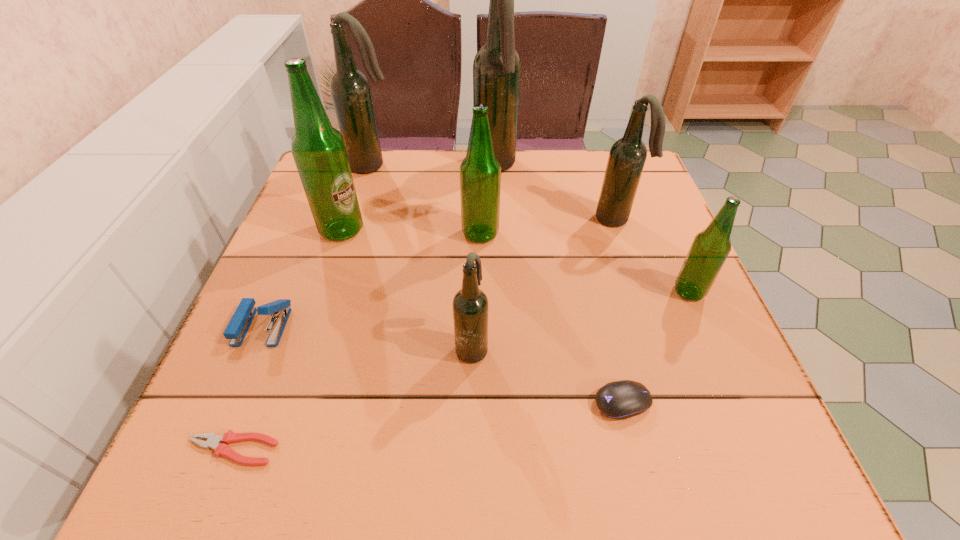
The width and height of the screenshot is (960, 540). What are the coordinates of `vacant point located 0.270m on the front of the sixth beer bottle from left to right` in the screenshot? It's located at (651, 321).

This screenshot has width=960, height=540. In order to click on blank area located 0.060m on the label of the second green beer bottle from right to left in this screenshot , I will do `click(436, 234)`.

At what (x,y) coordinates should I click in order to perform the action: click on free space located 0.140m on the label of the second green beer bottle from right to left. Please return your answer as a coordinate pair (x, y). Looking at the image, I should click on (400, 234).

You are a GUI agent. You are given a task and a screenshot of the screen. Output one action in this format:
    pyautogui.click(x=<x>, y=<y>)
    Task: Click on the free region located 0.050m on the label of the second green beer bottle from right to left
    
    Given the screenshot: What is the action you would take?
    pyautogui.click(x=440, y=234)

Locate an element on the screen. This screenshot has height=540, width=960. vacant space situated on the label of the rightmost green beer bottle is located at coordinates (514, 292).

Image resolution: width=960 pixels, height=540 pixels. I want to click on free location located on the label of the rightmost green beer bottle, so click(x=523, y=292).

Locate an element on the screen. The height and width of the screenshot is (540, 960). free space located on the label of the rightmost green beer bottle is located at coordinates (528, 292).

In order to click on vacant position located on the right of the nearest dark beer bottle in this screenshot , I will do `click(565, 347)`.

Find the location of `vacant space located on the front of the third shortest object`. vacant space located on the front of the third shortest object is located at coordinates (236, 387).

Identify the location of free location located on the left of the black computer mouse. (433, 402).